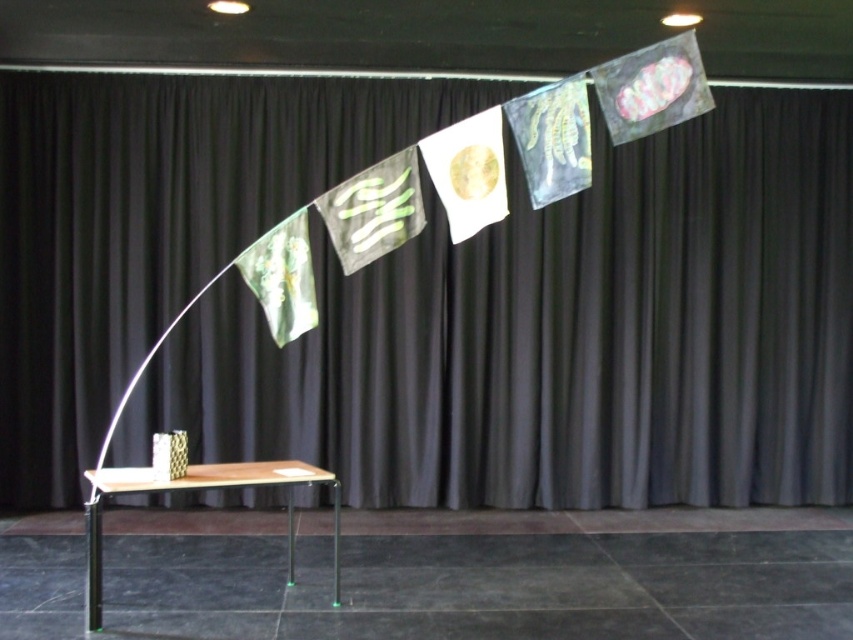
You are an event planner setting up for a presentation. You need to ensure that the black fabric curtain at upper center and the wooden table at center are visible to the audience. Considering their heights, which object might block the view of the other from the audience seated in the front row?

The black fabric curtain at upper center is much taller than the wooden table at center, so it might block the view of the wooden table at center from the audience in the front row.

You are an event organizer setting up a stage. You have a black fabric curtain at upper center that needs to be positioned exactly at point (564, 337). Can you confirm if there are any objects currently occupying that point?

Yes, the black fabric curtain at upper center is already located at point (564, 337).

You are an actor preparing to enter the stage and need to position yourself in front of both the black fabric curtain at upper center and the wooden table at center. Is this possible given their positions?

The wooden table at center is behind the black fabric curtain at upper center, so you cannot be in front of both at the same time. You can only be in front of the black fabric curtain at upper center, which is in front of the wooden table at center.